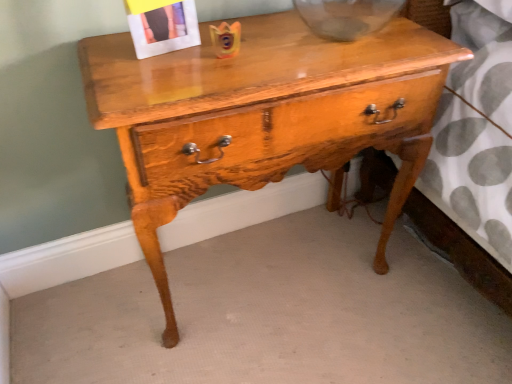
This screenshot has width=512, height=384. Identify the location of glossy wood nightstand at center. (263, 115).

This screenshot has width=512, height=384. Describe the element at coordinates (263, 115) in the screenshot. I see `glossy wood nightstand at center` at that location.

Find the location of a particular element. Image resolution: width=512 pixels, height=384 pixels. glossy wood nightstand at center is located at coordinates (263, 115).